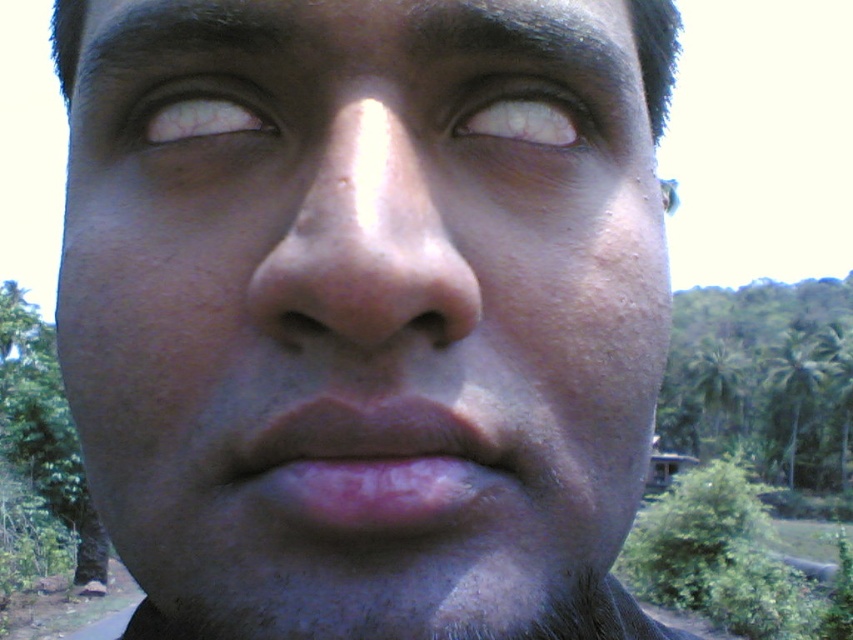
Is smooth skin face at center positioned in front of smooth skin nose at center?

Yes, it is in front of smooth skin nose at center.

Describe the element at coordinates (364, 316) in the screenshot. I see `smooth skin face at center` at that location.

Identify the location of smooth skin face at center. (364, 316).

Where is `smooth skin face at center`? smooth skin face at center is located at coordinates (364, 316).

Can you confirm if pink matte lips at center is positioned to the left of white matte eye at upper center?

Correct, you'll find pink matte lips at center to the left of white matte eye at upper center.

Is pink matte lips at center wider than white matte eye at upper center?

Indeed, pink matte lips at center has a greater width compared to white matte eye at upper center.

The height and width of the screenshot is (640, 853). In order to click on pink matte lips at center in this screenshot , I will do `click(378, 467)`.

Locate an element on the screen. pink matte lips at center is located at coordinates (378, 467).

Can you confirm if smooth skin nose at center is smaller than dark brown hair at upper center?

Yes, smooth skin nose at center is smaller than dark brown hair at upper center.

Does smooth skin nose at center have a greater height compared to dark brown hair at upper center?

No, smooth skin nose at center is not taller than dark brown hair at upper center.

Image resolution: width=853 pixels, height=640 pixels. What do you see at coordinates (364, 243) in the screenshot?
I see `smooth skin nose at center` at bounding box center [364, 243].

At what (x,y) coordinates should I click in order to perform the action: click on smooth skin nose at center. Please return your answer as a coordinate pair (x, y). This screenshot has height=640, width=853. Looking at the image, I should click on (364, 243).